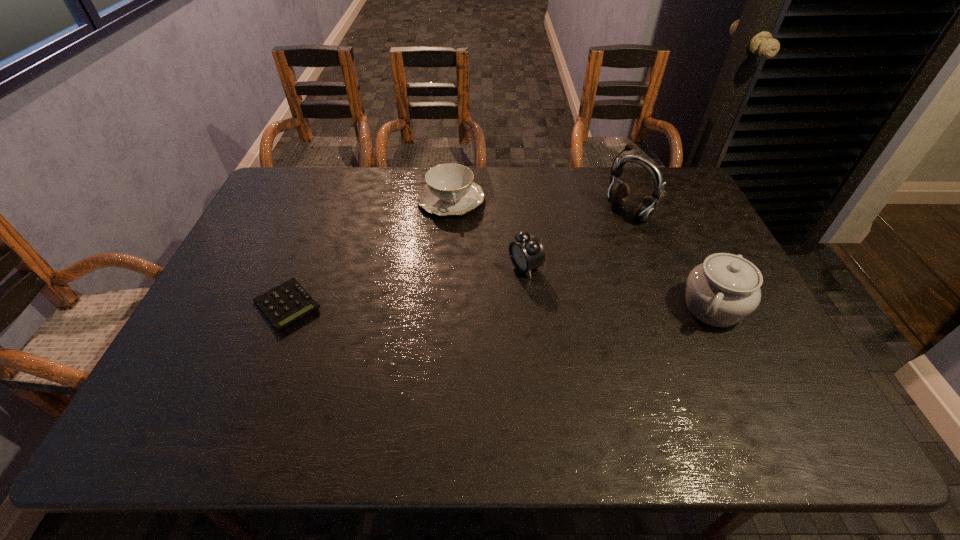
Locate an element on the screen. vacant space that's between the third object from left to right and the tallest object is located at coordinates (577, 239).

The image size is (960, 540). I want to click on free space between the right chinaware and the earphone, so click(x=670, y=260).

Choose which object is the third nearest neighbor to the second tallest object. Please provide its 2D coordinates. Your answer should be formatted as a tuple, i.e. [(x, y)], where the tuple contains the x and y coordinates of a point satisfying the conditions above.

[(449, 190)]

I want to click on object that is the second closest to the earphone, so click(526, 253).

The height and width of the screenshot is (540, 960). Identify the location of vacant region that satisfies the following two spatial constraints: 1. on the front side of the third shortest object; 2. on the left side of the shorter chinaware. (445, 267).

The height and width of the screenshot is (540, 960). Find the location of `free spot that satisfies the following two spatial constraints: 1. on the back side of the third shortest object; 2. on the left side of the shortest object`. free spot that satisfies the following two spatial constraints: 1. on the back side of the third shortest object; 2. on the left side of the shortest object is located at coordinates (302, 267).